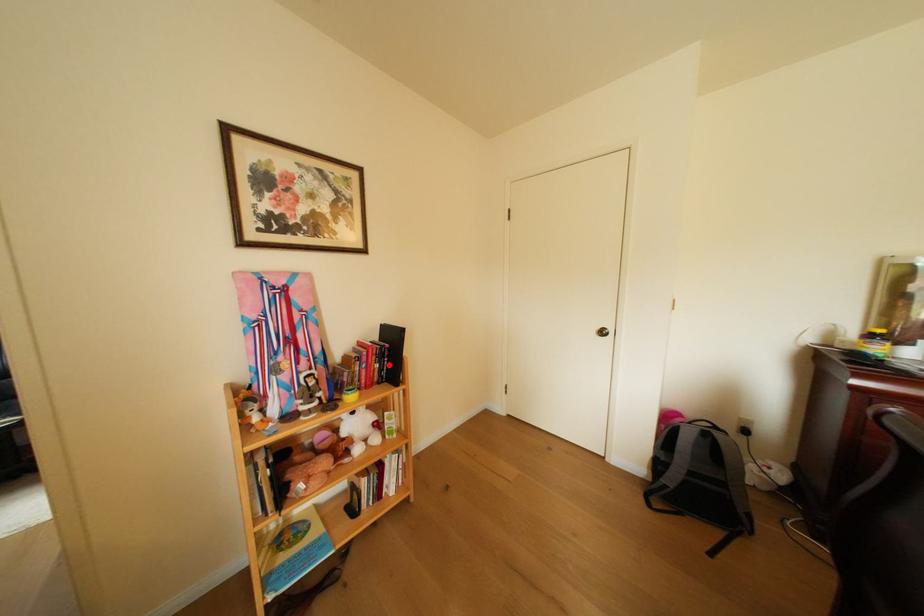
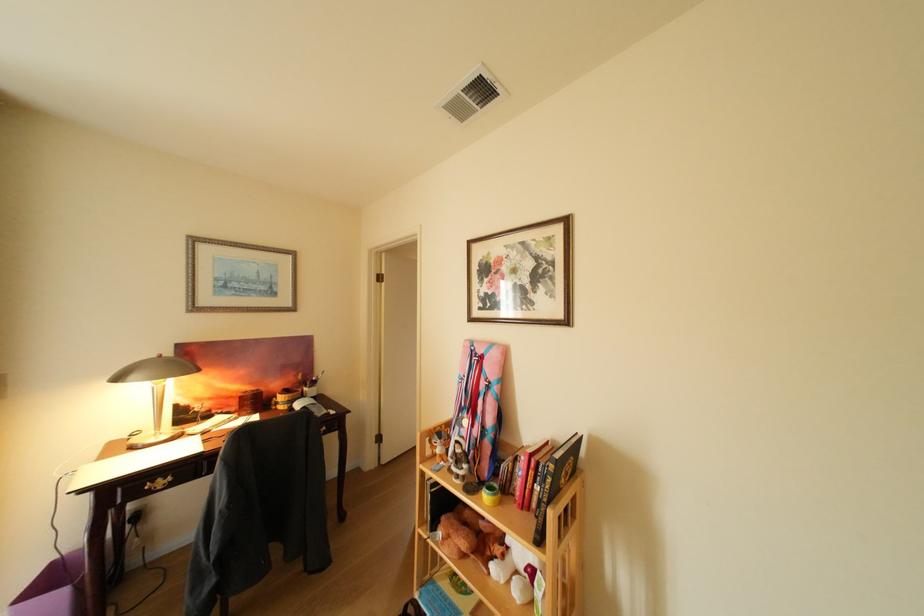
Question: I am providing you with two images of the same scene from different viewpoints. A red point is marked on the first image. Can you still see the location of the red point in image 2?

Choices:
 (A) Yes
 (B) No

Answer: (A)